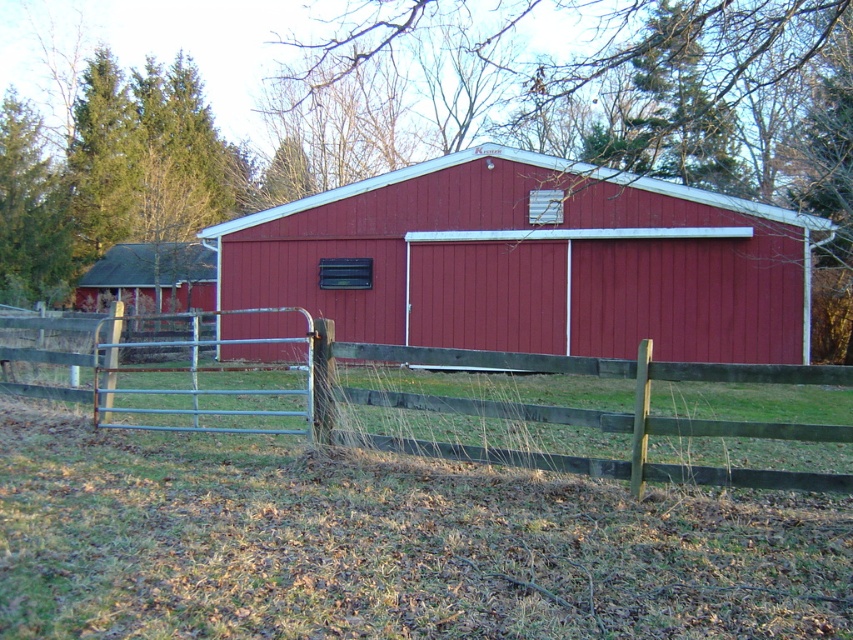
Consider the image. Is smooth red barn at center to the left of wooden fence at lower left from the viewer's perspective?

No, smooth red barn at center is not to the left of wooden fence at lower left.

Does point (358, 308) come behind point (560, 461)?

That is True.

Identify the location of smooth red barn at center. (532, 260).